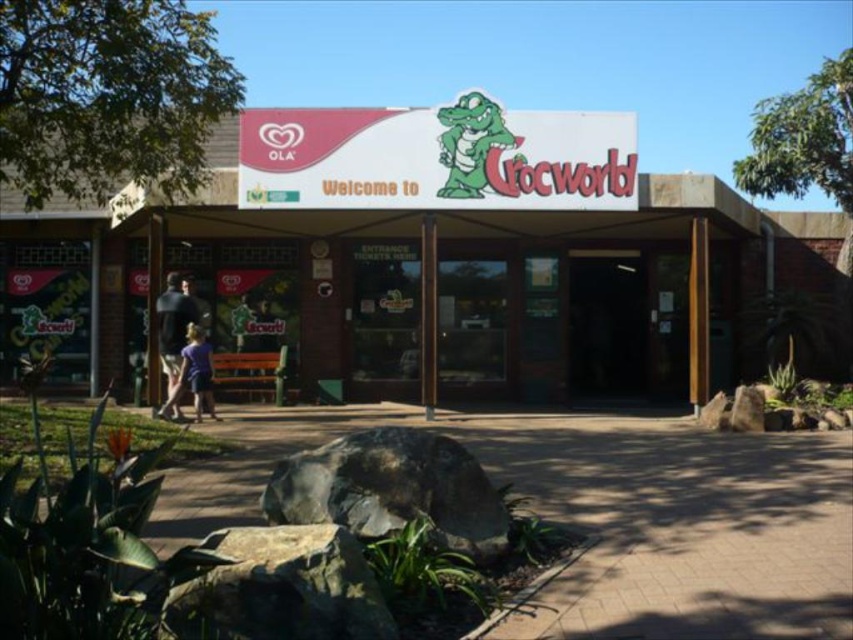
Question: Which point is farther from the camera taking this photo?

Choices:
 (A) (367, 353)
 (B) (187, 365)
 (C) (630, 340)

Answer: (C)

Question: Does white plastic sign at center have a larger size compared to black glass door at center?

Choices:
 (A) yes
 (B) no

Answer: (A)

Question: Is black glass door at center above purple fabric dress at center?

Choices:
 (A) no
 (B) yes

Answer: (B)

Question: Which point is closer to the camera?

Choices:
 (A) purple fabric dress at center
 (B) black glass door at center

Answer: (A)

Question: Among these objects, which one is nearest to the camera?

Choices:
 (A) black glass door at center
 (B) white plastic sign at center
 (C) purple fabric dress at center

Answer: (B)

Question: Can you confirm if white plastic sign at center is positioned to the left of purple fabric dress at center?

Choices:
 (A) yes
 (B) no

Answer: (B)